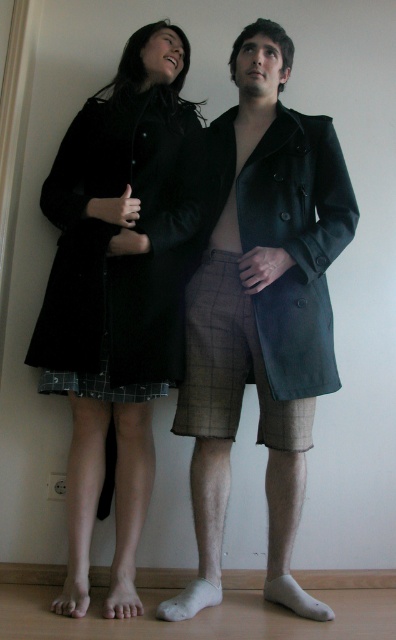
You are a photographer setting up for a portrait. You want to ensure that the brown checkered kilt at center is in focus. If your camera has a depth of field that can sharply capture objects within 5 feet of the focal point, should you adjust your focus to be closer or farther away from the kilt?

The brown checkered kilt at center is 5.89 feet from the camera. Since the depth of field can only sharply capture objects within 5 feet of the focal point, the kilt is outside this range. To keep it in focus, you should adjust your focus to be closer to the kilt.

You are a tailor who needs to store the matte black coat at center and the plaid fabric kilt at lower center in a wardrobe. Given that the wardrobe has a limited space, which item requires more space due to its size?

The matte black coat at center requires more space because it is larger in size than the plaid fabric kilt at lower center.

You are a tailor measuring two kilts in a room. The brown checkered kilt at center and the plaid fabric kilt at lower center. Which kilt has a greater width?

The brown checkered kilt at center has a greater width than the plaid fabric kilt at lower center.